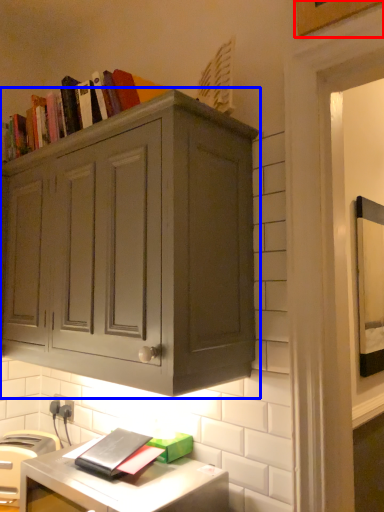
Question: Among these objects, which one is farthest to the camera, picture frame (highlighted by a red box) or cabinetry (highlighted by a blue box)?

Choices:
 (A) picture frame
 (B) cabinetry

Answer: (A)